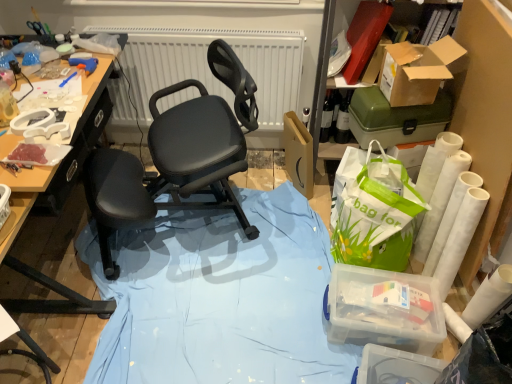
Question: Is green plastic toolbox at upper right, positioned as the 3th box in bottom-to-top order, in front of transparent plastic container at lower right, marked as the 1th box in a bottom-to-top arrangement?

Choices:
 (A) yes
 (B) no

Answer: (B)

Question: From a real-world perspective, is green plastic toolbox at upper right, positioned as the 3th box in bottom-to-top order, on transparent plastic container at lower right, which appears as the fourth box when viewed from the top?

Choices:
 (A) no
 (B) yes

Answer: (B)

Question: From a real-world perspective, is green plastic toolbox at upper right, positioned as the 3th box in bottom-to-top order, under transparent plastic container at lower right, which appears as the fourth box when viewed from the top?

Choices:
 (A) yes
 (B) no

Answer: (B)

Question: Is green plastic toolbox at upper right, which is the second box in top-to-bottom order, facing towards transparent plastic container at lower right, marked as the 1th box in a bottom-to-top arrangement?

Choices:
 (A) no
 (B) yes

Answer: (A)

Question: Does green plastic toolbox at upper right, positioned as the 3th box in bottom-to-top order, touch transparent plastic container at lower right, marked as the 1th box in a bottom-to-top arrangement?

Choices:
 (A) no
 (B) yes

Answer: (A)

Question: Does point (353, 299) appear closer or farther from the camera than point (65, 137)?

Choices:
 (A) closer
 (B) farther

Answer: (B)

Question: Is clear plastic container at lower right, the second box in the bottom-to-top sequence, wider or thinner than white plastic tray at upper left?

Choices:
 (A) thin
 (B) wide

Answer: (B)

Question: Is clear plastic container at lower right, the second box in the bottom-to-top sequence, taller or shorter than white plastic tray at upper left?

Choices:
 (A) short
 (B) tall

Answer: (B)

Question: Based on their positions, is clear plastic container at lower right, the third box viewed from the top, located to the left or right of white plastic tray at upper left?

Choices:
 (A) right
 (B) left

Answer: (A)

Question: From a real-world perspective, relative to cardboard box at upper right, the first box from the top, is clear plastic container at lower right, the second box in the bottom-to-top sequence, vertically above or below?

Choices:
 (A) below
 (B) above

Answer: (A)

Question: Is clear plastic container at lower right, the third box viewed from the top, in front of or behind cardboard box at upper right, which is the 4th box from bottom to top, in the image?

Choices:
 (A) behind
 (B) front

Answer: (A)

Question: Is clear plastic container at lower right, the third box viewed from the top, inside the boundaries of cardboard box at upper right, which is the 4th box from bottom to top, or outside?

Choices:
 (A) inside
 (B) outside

Answer: (B)

Question: Visually, is clear plastic container at lower right, the third box viewed from the top, positioned to the left or to the right of cardboard box at upper right, which is the 4th box from bottom to top?

Choices:
 (A) left
 (B) right

Answer: (A)

Question: Considering their positions, is transparent plastic container at lower right, which appears as the fourth box when viewed from the top, located in front of or behind cardboard box at upper right, which is the 4th box from bottom to top?

Choices:
 (A) behind
 (B) front

Answer: (B)

Question: From a real-world perspective, is transparent plastic container at lower right, marked as the 1th box in a bottom-to-top arrangement, above or below cardboard box at upper right, the first box from the top?

Choices:
 (A) above
 (B) below

Answer: (B)